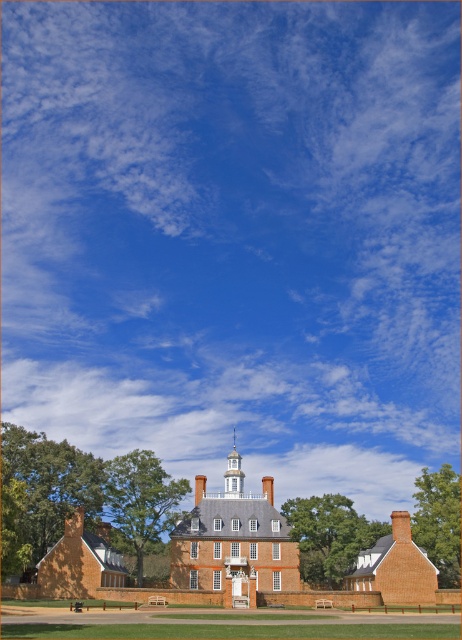
You are standing in front of the grand historic brick building and want to locate the red brick chimney at center. According to the coordinates provided, where would you look relative to the center of the image?

The red brick chimney at center is located at coordinates point [200,486], which is slightly to the right and slightly above the center of the image.